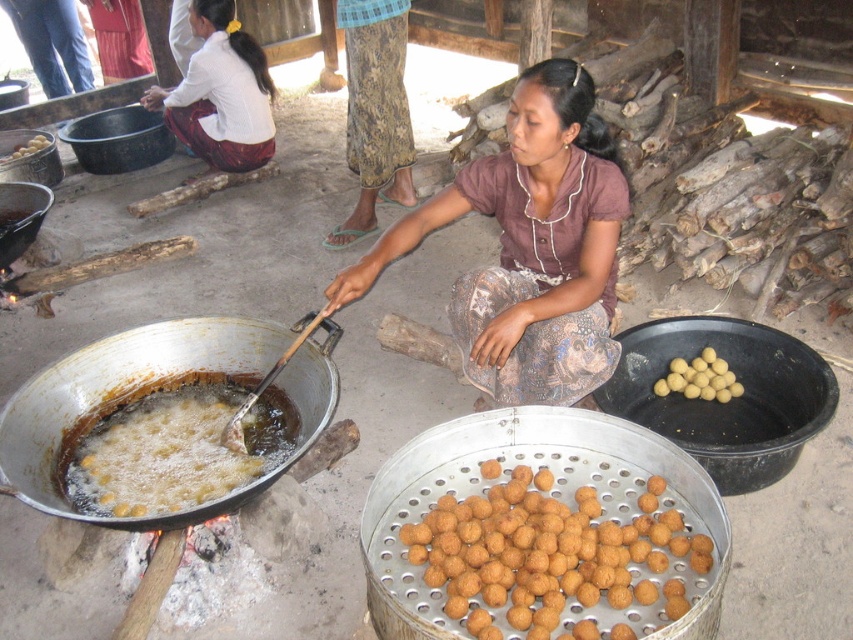
Question: Can you confirm if white fabric at upper left is positioned to the left of golden matte balls at center?

Choices:
 (A) yes
 (B) no

Answer: (A)

Question: Does golden crispy balls at lower left lie in front of shiny silver wok at left?

Choices:
 (A) no
 (B) yes

Answer: (B)

Question: Does golden matte balls at center appear on the right side of yellow matte balls at center?

Choices:
 (A) yes
 (B) no

Answer: (A)

Question: Which of the following is the farthest from the observer?

Choices:
 (A) (6, 214)
 (B) (572, 342)
 (C) (674, 356)
 (D) (42, 140)

Answer: (D)

Question: Among these objects, which one is nearest to the camera?

Choices:
 (A) golden crispy balls at lower left
 (B) golden matte balls at center
 (C) golden crispy balls at center

Answer: (C)

Question: Which of the following is the closest to the observer?

Choices:
 (A) yellow matte balls at center
 (B) golden crispy balls at center

Answer: (B)